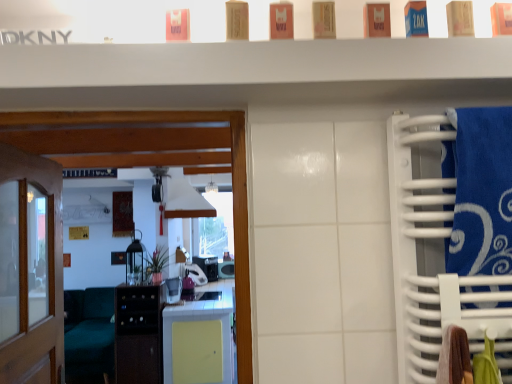
Question: Should I look upward or downward to see black plastic microwave at center, the 5th appliance in the front-to-back sequence?

Choices:
 (A) down
 (B) up

Answer: (A)

Question: From a real-world perspective, does black plastic toaster at center, acting as the 2th appliance starting from the back, stand above white matte exhaust hood at center?

Choices:
 (A) no
 (B) yes

Answer: (A)

Question: Would you say black plastic toaster at center, acting as the 2th appliance starting from the back, contains white matte exhaust hood at center?

Choices:
 (A) no
 (B) yes

Answer: (A)

Question: Is black plastic toaster at center, acting as the 2th appliance starting from the back, to the left of white matte exhaust hood at center from the viewer's perspective?

Choices:
 (A) yes
 (B) no

Answer: (B)

Question: From the image's perspective, would you say black plastic toaster at center, acting as the 2th appliance starting from the back, is positioned over white matte exhaust hood at center?

Choices:
 (A) yes
 (B) no

Answer: (B)

Question: Is black plastic toaster at center, acting as the 2th appliance starting from the back, oriented towards white matte exhaust hood at center?

Choices:
 (A) no
 (B) yes

Answer: (A)

Question: Is black plastic toaster at center, acting as the 2th appliance starting from the back, smaller than white matte exhaust hood at center?

Choices:
 (A) yes
 (B) no

Answer: (A)

Question: Is white glossy microwave at center, placed as the 5th appliance when sorted from back to front, positioned in front of blue fabric towel at right?

Choices:
 (A) no
 (B) yes

Answer: (A)

Question: From a real-world perspective, does white glossy microwave at center, the first appliance when ordered from front to back, stand above blue fabric towel at right?

Choices:
 (A) no
 (B) yes

Answer: (A)

Question: From the image's perspective, would you say white glossy microwave at center, placed as the 5th appliance when sorted from back to front, is shown under blue fabric towel at right?

Choices:
 (A) yes
 (B) no

Answer: (A)

Question: Is white glossy microwave at center, placed as the 5th appliance when sorted from back to front, shorter than blue fabric towel at right?

Choices:
 (A) yes
 (B) no

Answer: (A)

Question: Considering the relative sizes of white glossy microwave at center, placed as the 5th appliance when sorted from back to front, and blue fabric towel at right in the image provided, is white glossy microwave at center, placed as the 5th appliance when sorted from back to front, taller than blue fabric towel at right?

Choices:
 (A) no
 (B) yes

Answer: (A)

Question: Would you consider white glossy microwave at center, placed as the 5th appliance when sorted from back to front, to be distant from blue fabric towel at right?

Choices:
 (A) no
 (B) yes

Answer: (B)

Question: Is blue fabric towel at right facing away from purple plastic toaster at center, which is the third appliance from back to front?

Choices:
 (A) yes
 (B) no

Answer: (B)